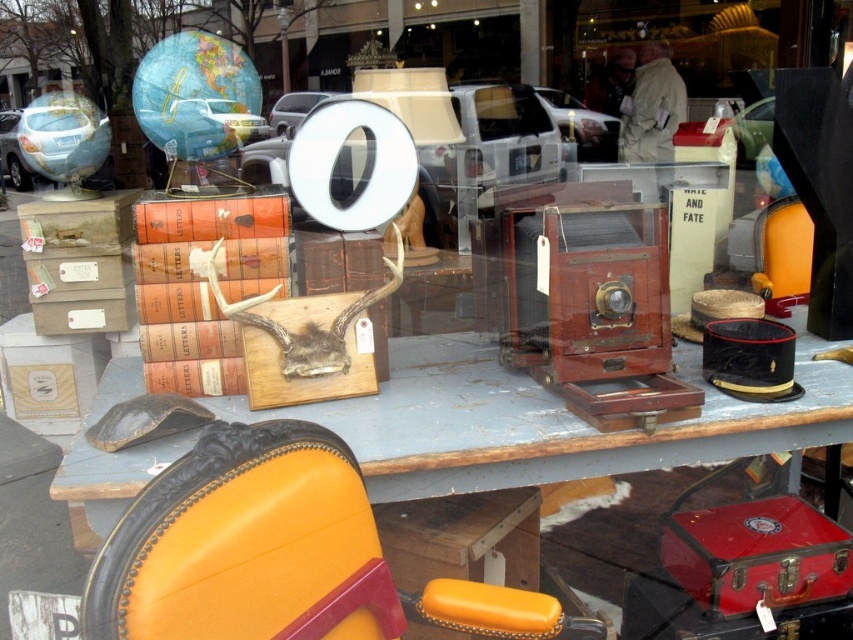
In the scene shown: Between leather seat at center and wooden table at center, which one is positioned higher?

wooden table at center is higher up.

Does leather seat at center have a lesser height compared to wooden table at center?

In fact, leather seat at center may be taller than wooden table at center.

Is point (498, 589) positioned after point (518, 444)?

That is False.

Where is `leather seat at center`? The width and height of the screenshot is (853, 640). leather seat at center is located at coordinates (281, 554).